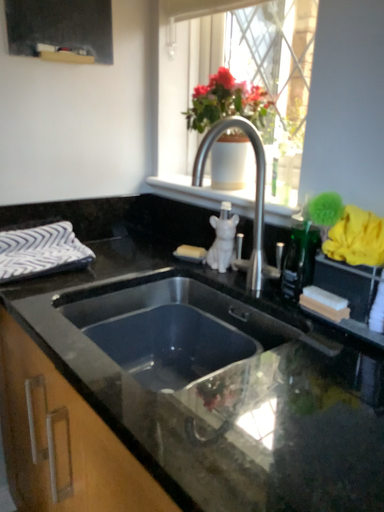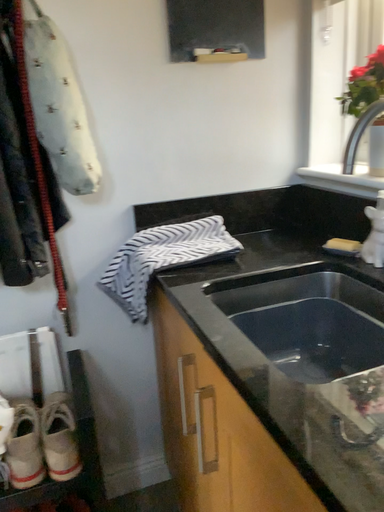
Question: Which way did the camera rotate in the video?

Choices:
 (A) rotated left
 (B) rotated right

Answer: (A)